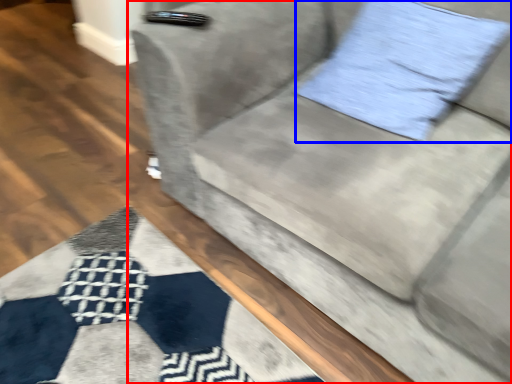
Question: Which point is further to the camera, studio couch (highlighted by a red box) or pillow (highlighted by a blue box)?

Choices:
 (A) studio couch
 (B) pillow

Answer: (B)